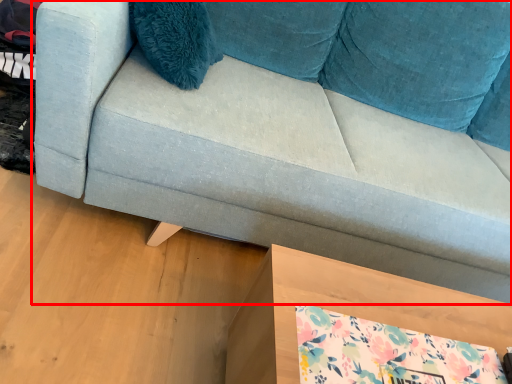
Question: Observing the image, what is the correct spatial positioning of studio couch (annotated by the red box) in reference to table?

Choices:
 (A) left
 (B) right

Answer: (B)